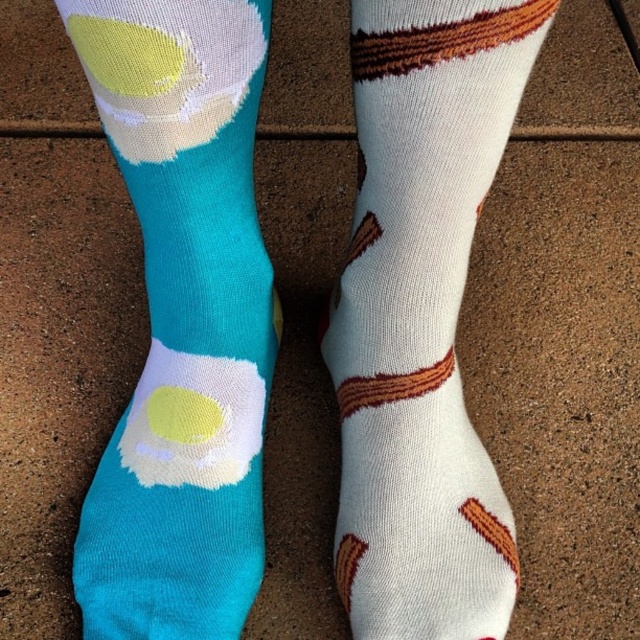
Consider the image. You are standing in a room and see the turquoise soft cotton socks at left and the white cotton socks with brown stripes at right. Which sock is positioned to the left of the other?

The turquoise soft cotton socks at left is positioned to the left of the white cotton socks with brown stripes at right.

You are a photographer setting up a shoot. You need to ensure that the turquoise soft cotton socks at left and the white cotton socks with brown stripes at right are both visible in the final image. Given their current positions, which sock is covering part of the other?

The turquoise soft cotton socks at left is positioned over white cotton socks with brown stripes at right, so it is covering part of the white cotton socks with brown stripes at right.